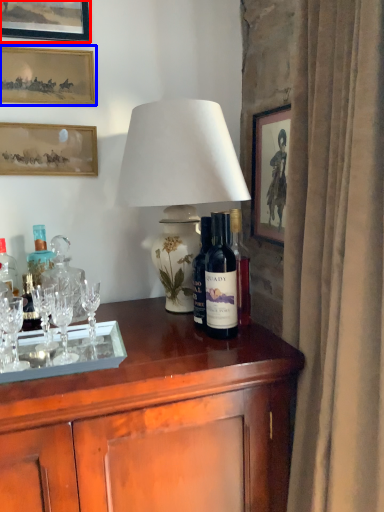
Question: Which of the following is the farthest to the observer, picture frame (highlighted by a red box) or picture frame (highlighted by a blue box)?

Choices:
 (A) picture frame
 (B) picture frame

Answer: (B)